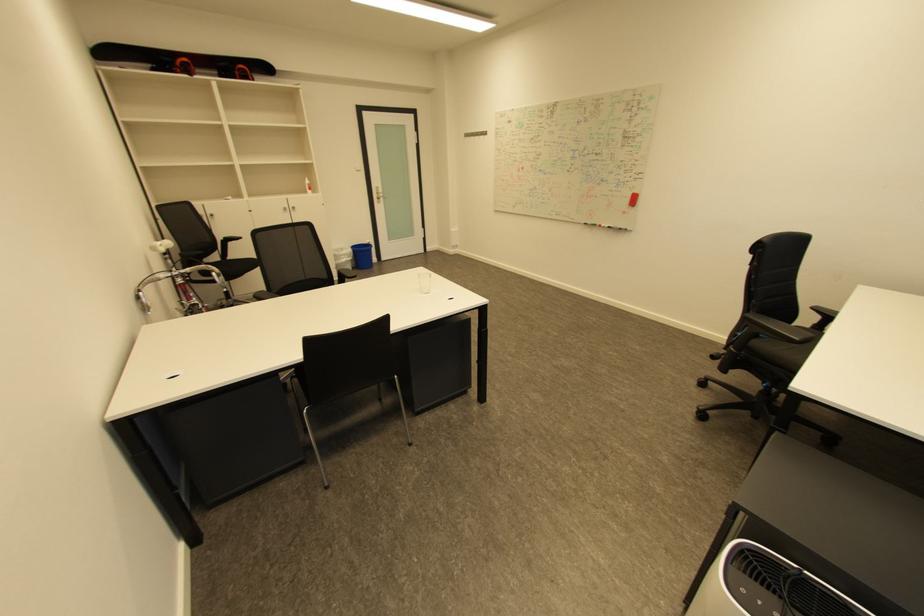
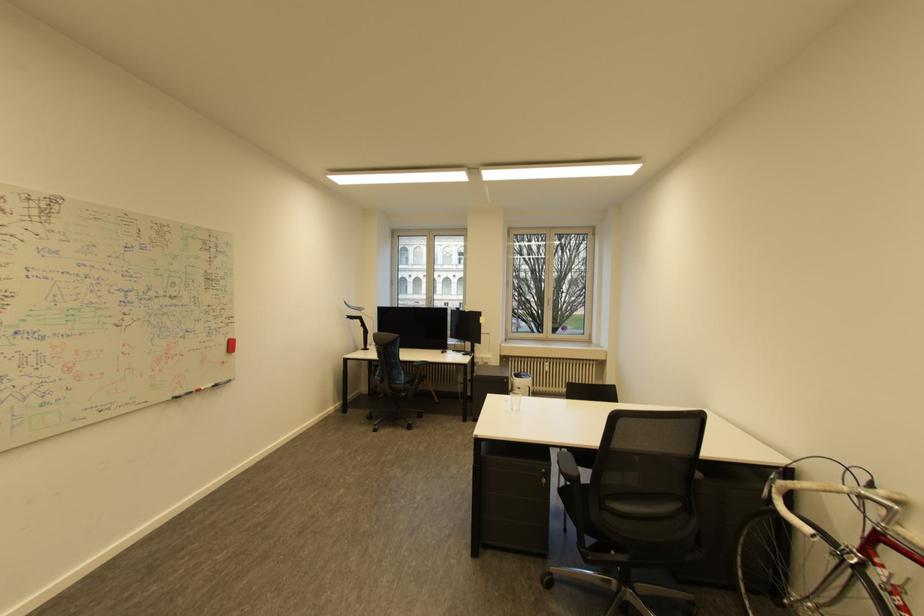
Locate, in the second image, the point that corresponds to (638,195) in the first image.

(234, 342)